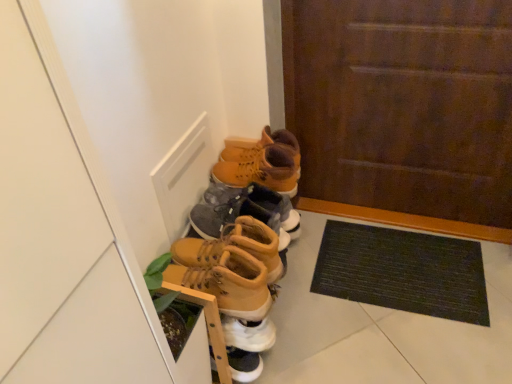
Locate an element on the screen. vacant point above matte brown boot at center, which appears as the second footwear when ordered from the bottom (from a real-world perspective) is located at coordinates (232, 187).